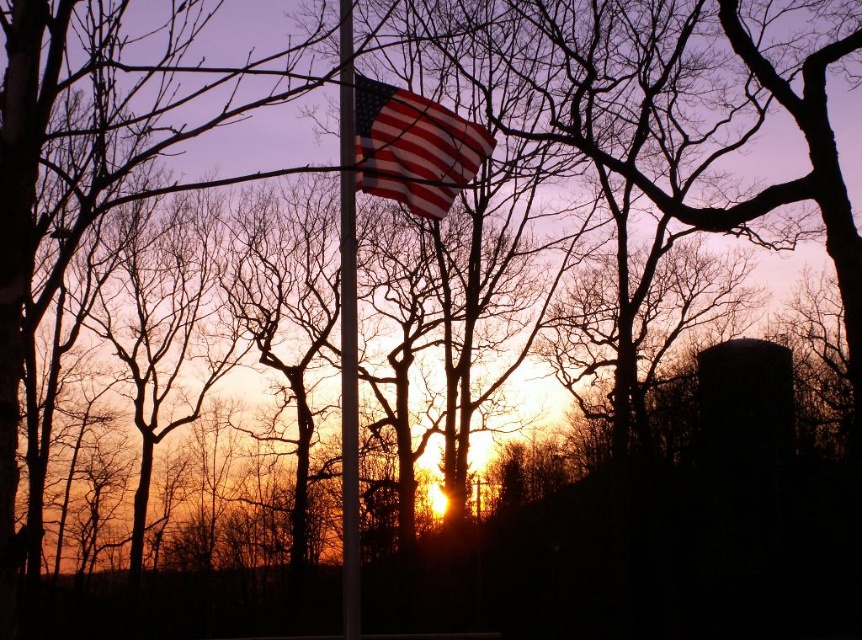
Question: Can you confirm if american flag at center is positioned above metallic pole at center?

Choices:
 (A) yes
 (B) no

Answer: (A)

Question: Can you confirm if american flag at center is positioned to the left of metallic pole at center?

Choices:
 (A) no
 (B) yes

Answer: (A)

Question: Which object is farther from the camera taking this photo?

Choices:
 (A) metallic pole at center
 (B) american flag at center

Answer: (B)

Question: Is american flag at center to the left of metallic pole at center from the viewer's perspective?

Choices:
 (A) yes
 (B) no

Answer: (B)

Question: Among these objects, which one is farthest from the camera?

Choices:
 (A) american flag at center
 (B) metallic pole at center

Answer: (A)